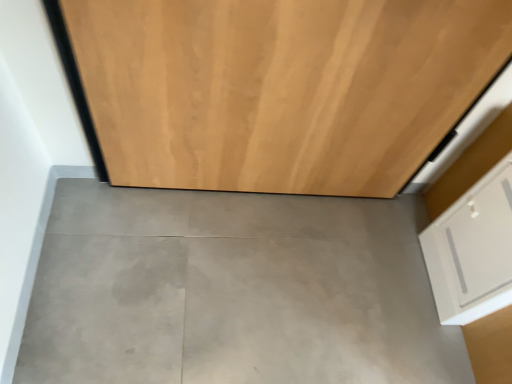
This screenshot has height=384, width=512. I want to click on vacant space underneath wooden door at center (from a real-world perspective), so click(264, 193).